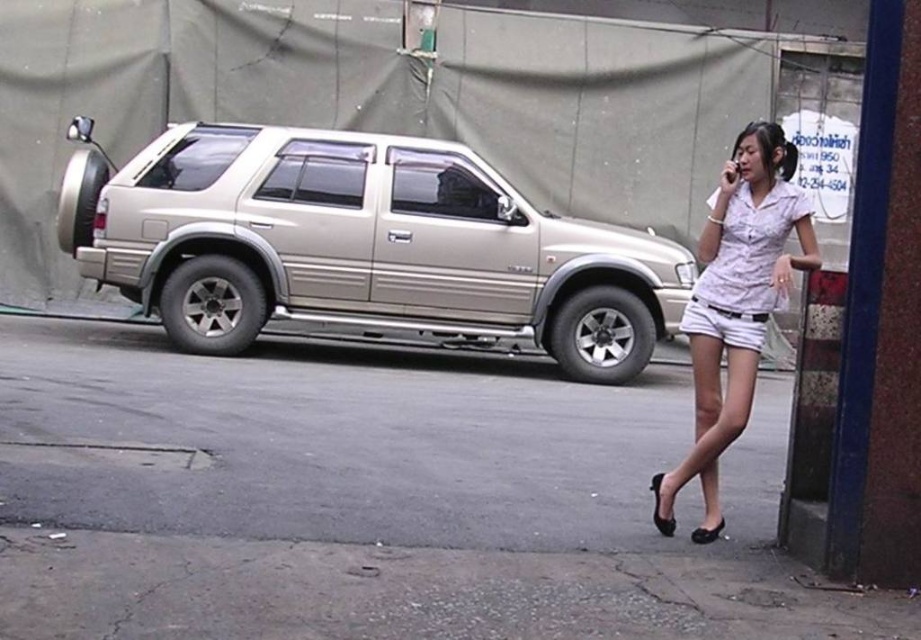
Question: Estimate the real-world distances between objects in this image. Which object is closer to the metallic gold minivan at left?

Choices:
 (A) white matte shorts at lower right
 (B) gray asphalt pavement at lower center

Answer: (A)

Question: Can you confirm if metallic gold minivan at left is positioned above white matte shorts at lower right?

Choices:
 (A) yes
 (B) no

Answer: (A)

Question: Among these points, which one is farthest from the camera?

Choices:
 (A) (707, 410)
 (B) (313, 433)

Answer: (B)

Question: Which point is farther to the camera?

Choices:
 (A) white cotton shorts at center
 (B) white matte shorts at lower right
 (C) metallic gold minivan at left

Answer: (C)

Question: Can you confirm if gray asphalt pavement at lower center is positioned above metallic gold minivan at left?

Choices:
 (A) no
 (B) yes

Answer: (A)

Question: Is gray asphalt pavement at lower center to the left of white cotton shorts at center from the viewer's perspective?

Choices:
 (A) no
 (B) yes

Answer: (A)